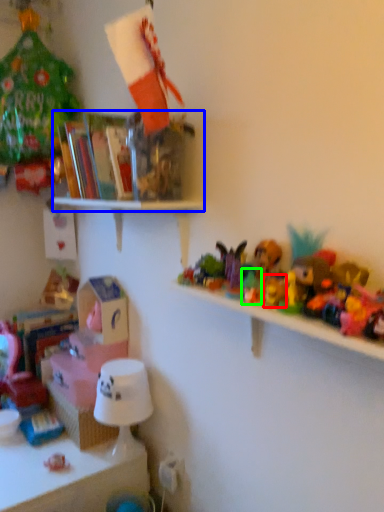
Question: Estimate the real-world distances between objects in this image. Which object is farther from toy (highlighted by a red box), shelf (highlighted by a blue box) or toy (highlighted by a green box)?

Choices:
 (A) shelf
 (B) toy

Answer: (A)